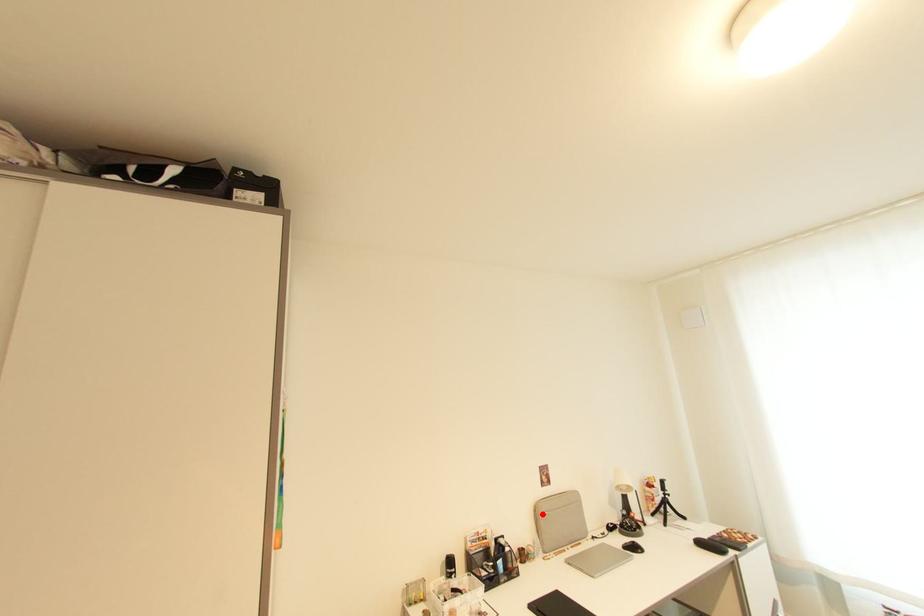
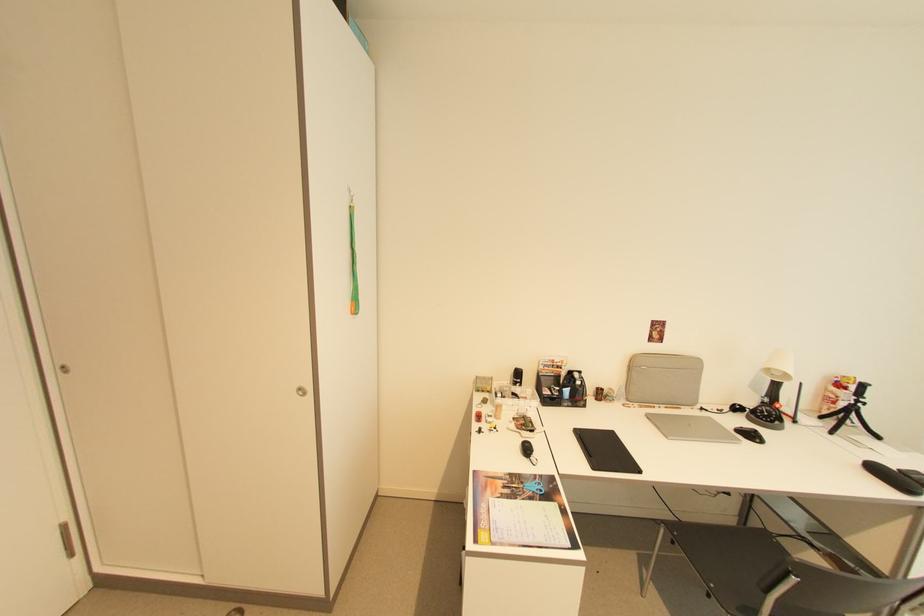
Question: A red point is marked in image1. In image2, is the corresponding 3D point closer to the camera or farther? Reply with the corresponding letter.

Choices:
 (A) The corresponding 3D point is closer.
 (B) The corresponding 3D point is farther.

Answer: (A)